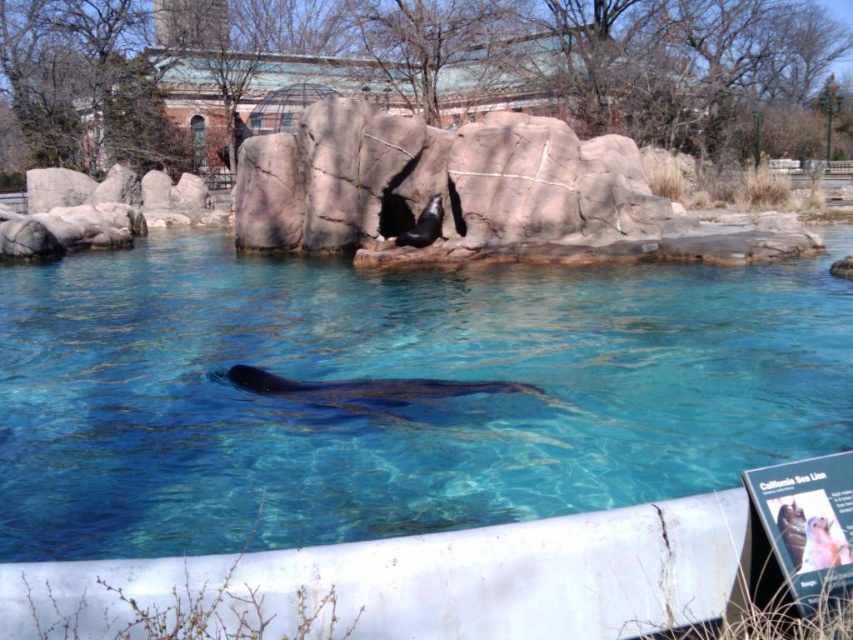
Between clear blue water at center and rough stone rock at center, which one is positioned lower?

clear blue water at center

Which is behind, point (535, 330) or point (592, 241)?

Positioned behind is point (592, 241).

The image size is (853, 640). Describe the element at coordinates (393, 410) in the screenshot. I see `clear blue water at center` at that location.

The width and height of the screenshot is (853, 640). I want to click on clear blue water at center, so click(393, 410).

Is clear blue water at center to the left of black fur seal at center from the viewer's perspective?

Incorrect, clear blue water at center is not on the left side of black fur seal at center.

Between clear blue water at center and black fur seal at center, which one is positioned lower?

clear blue water at center

Between point (483, 356) and point (431, 204), which one is positioned behind?

Point (431, 204)

Find the location of a particular element. clear blue water at center is located at coordinates (393, 410).

In the scene shown: Is rough stone rock at center smaller than black smooth whale at center?

Incorrect, rough stone rock at center is not smaller in size than black smooth whale at center.

Who is lower down, rough stone rock at center or black smooth whale at center?

black smooth whale at center

From the picture: Who is more distant from viewer, (488,189) or (264,390)?

The point (488,189) is behind.

Image resolution: width=853 pixels, height=640 pixels. In order to click on rough stone rock at center in this screenshot , I will do `click(439, 182)`.